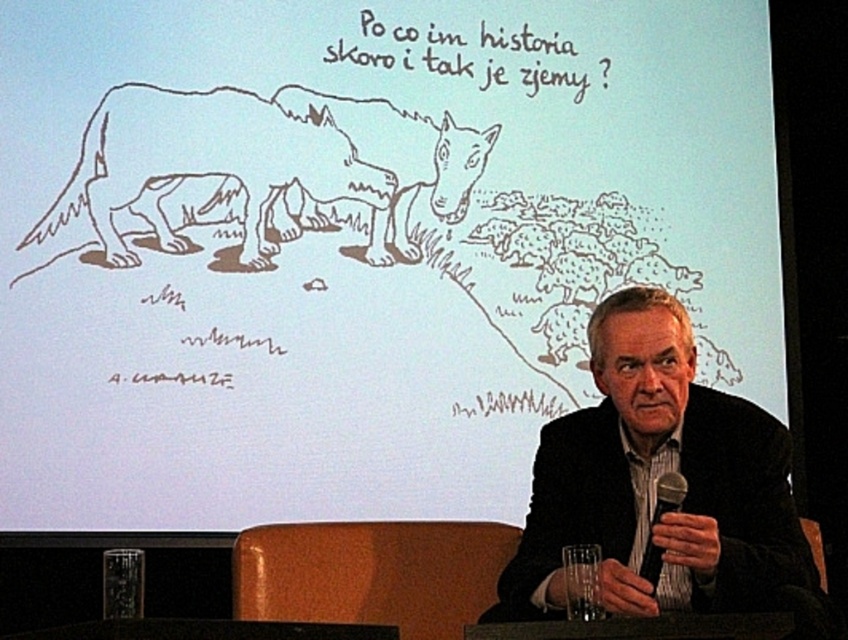
Question: Is black textured suit at center to the right of brown sketchy wolf at upper left from the viewer's perspective?

Choices:
 (A) no
 (B) yes

Answer: (B)

Question: Considering the relative positions of black textured suit at center and black metallic microphone at lower center in the image provided, where is black textured suit at center located with respect to black metallic microphone at lower center?

Choices:
 (A) below
 (B) above

Answer: (B)

Question: Is black textured suit at center positioned before brown sketchy wolf at upper left?

Choices:
 (A) no
 (B) yes

Answer: (B)

Question: Which point is closer to the camera taking this photo?

Choices:
 (A) (745, 522)
 (B) (671, 499)
 (C) (408, 134)

Answer: (B)

Question: Which point is farther to the camera?

Choices:
 (A) (86, 198)
 (B) (664, 484)
 (C) (506, 616)

Answer: (A)

Question: Which of the following is the closest to the observer?

Choices:
 (A) brown sketchy wolf at upper left
 (B) black metallic microphone at lower center
 (C) black textured suit at center

Answer: (C)